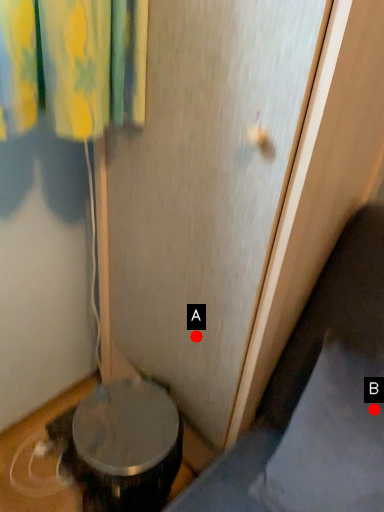
Question: Two points are circled on the image, labeled by A and B beside each circle. Which point is farther from the camera taking this photo?

Choices:
 (A) A is further
 (B) B is further

Answer: (A)